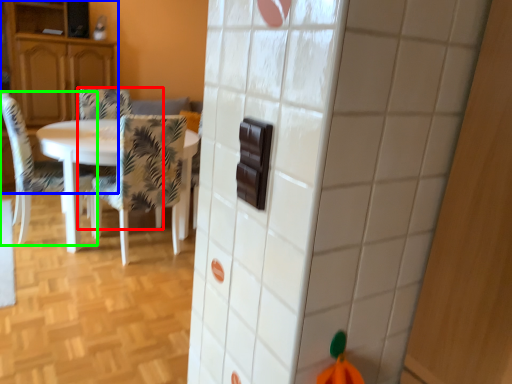
Question: Which object is positioned closest to chair (highlighted by a red box)? Select from cabinetry (highlighted by a blue box) and chair (highlighted by a green box).

Choices:
 (A) cabinetry
 (B) chair

Answer: (A)